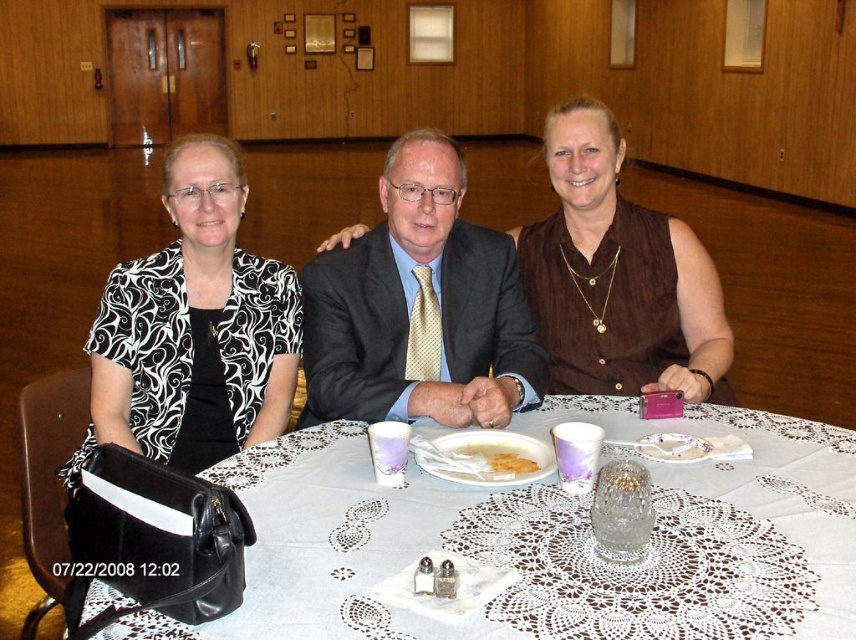
Question: Which object is closer to the camera taking this photo?

Choices:
 (A) white creamy soup at center
 (B) white lace tablecloth at center
 (C) matte black suit at center

Answer: (B)

Question: Is white lace tablecloth at center thinner than brown matte dress at center?

Choices:
 (A) yes
 (B) no

Answer: (B)

Question: Is black printed fabric at left above white creamy soup at center?

Choices:
 (A) no
 (B) yes

Answer: (B)

Question: Among these points, which one is farthest from the camera?

Choices:
 (A) (492, 476)
 (B) (189, 387)

Answer: (B)

Question: Is black printed fabric at left in front of yellow crumbly cake at center?

Choices:
 (A) yes
 (B) no

Answer: (A)

Question: Which of these objects is positioned closest to the yellow crumbly cake at center?

Choices:
 (A) matte black suit at center
 (B) white lace tablecloth at center

Answer: (B)